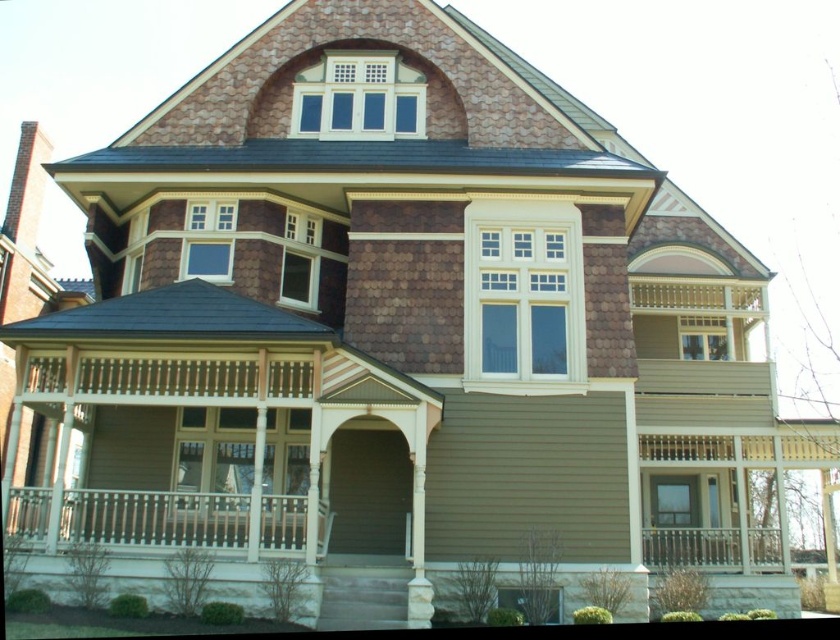
You are standing on the porch of the Victorian house and want to walk from the white wooden balustrade at lower left to the white painted wood balustrade at lower right. Which direction should you move to get closer to the latter?

You should move towards the right because the white painted wood balustrade at lower right is located to your right side and further away from your current position at the white wooden balustrade at lower left.